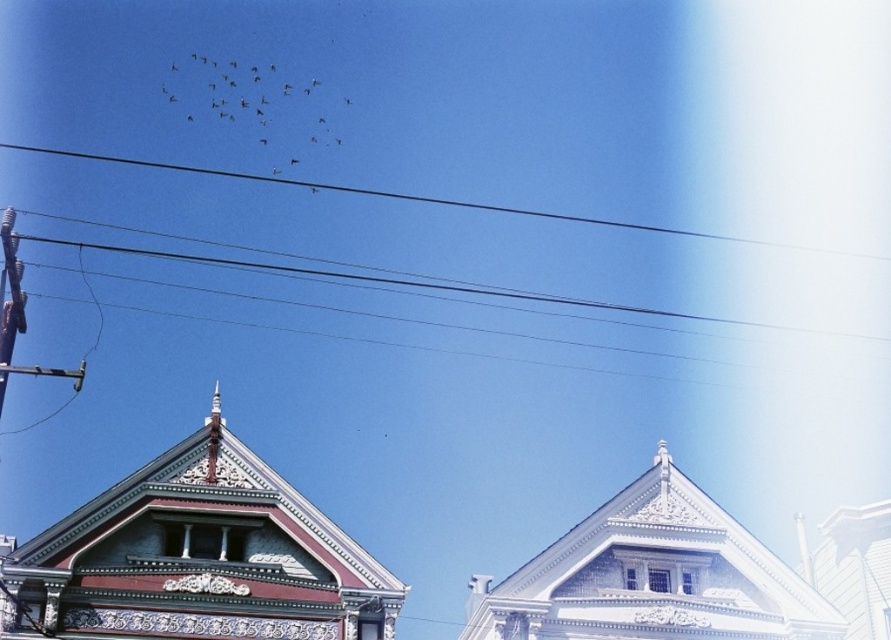
Does dark gray feathers at upper center have a lesser height compared to black wire at upper center?

Incorrect, dark gray feathers at upper center's height does not fall short of black wire at upper center's.

Is dark gray feathers at upper center wider than black wire at upper center?

In fact, dark gray feathers at upper center might be narrower than black wire at upper center.

What do you see at coordinates (248, 99) in the screenshot? The width and height of the screenshot is (891, 640). I see `dark gray feathers at upper center` at bounding box center [248, 99].

Image resolution: width=891 pixels, height=640 pixels. I want to click on dark gray feathers at upper center, so click(x=248, y=99).